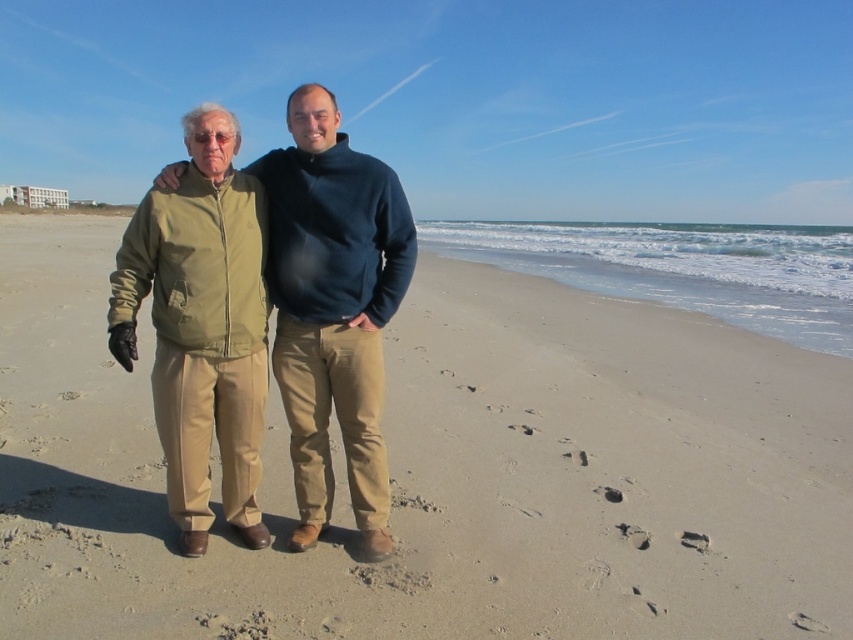
Does light brown sand at center have a greater height compared to khaki cotton pants at center?

Correct, light brown sand at center is much taller as khaki cotton pants at center.

Does light brown sand at center appear on the right side of khaki cotton pants at center?

Indeed, light brown sand at center is positioned on the right side of khaki cotton pants at center.

Is point (660, 339) closer to viewer compared to point (219, 193)?

That is False.

You are a GUI agent. You are given a task and a screenshot of the screen. Output one action in this format:
    pyautogui.click(x=<x>, y=<y>)
    Task: Click on the light brown sand at center
    This screenshot has width=853, height=640.
    Given the screenshot: What is the action you would take?
    pyautogui.click(x=439, y=472)